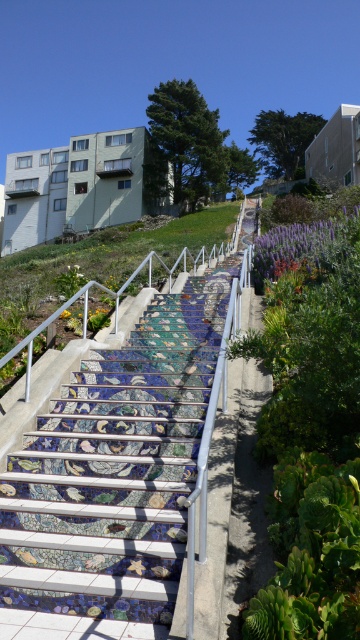
Does purple matte flower at upper center have a greater width compared to yellow matte flower at lower center?

No.

Image resolution: width=360 pixels, height=640 pixels. Describe the element at coordinates (291, 246) in the screenshot. I see `purple matte flower at upper center` at that location.

This screenshot has height=640, width=360. Identify the location of purple matte flower at upper center. (291, 246).

Is point (7, 460) more distant than point (307, 237)?

No, (7, 460) is in front of (307, 237).

Does mosaic tile stairs at center have a larger size compared to purple matte flower at upper center?

Indeed, mosaic tile stairs at center has a larger size compared to purple matte flower at upper center.

Is point (25, 541) farther from camera compared to point (258, 252)?

No, it is in front of (258, 252).

At what (x,y) coordinates should I click in order to perform the action: click on mosaic tile stairs at center. Please return your answer as a coordinate pair (x, y). The width and height of the screenshot is (360, 640). Looking at the image, I should click on (115, 470).

Does point (177, 488) lie behind point (64, 314)?

No, it is not.

Does mosaic tile stairs at center have a larger size compared to yellow matte flower at lower center?

Correct, mosaic tile stairs at center is larger in size than yellow matte flower at lower center.

Between point (223, 317) and point (66, 312), which one is positioned behind?

Point (66, 312)

Locate an element on the screen. Image resolution: width=360 pixels, height=640 pixels. mosaic tile stairs at center is located at coordinates (115, 470).